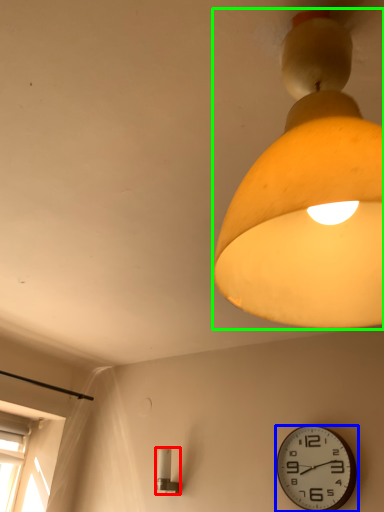
Question: Estimate the real-world distances between objects in this image. Which object is farther from lamp (highlighted by a red box), wall clock (highlighted by a blue box) or lamp (highlighted by a green box)?

Choices:
 (A) wall clock
 (B) lamp

Answer: (B)